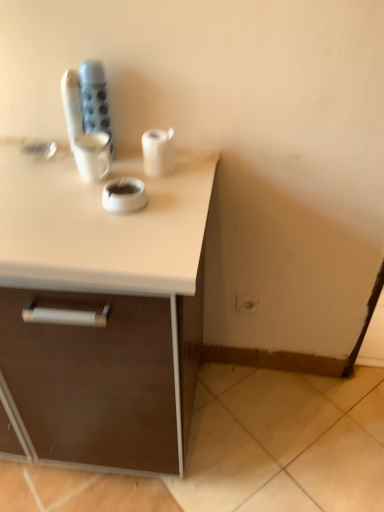
This screenshot has height=512, width=384. In order to click on white matte paper towel at center in this screenshot , I will do `click(158, 152)`.

Does white matte paper towel at center contain white plastic electric outlet at lower right?

No, white plastic electric outlet at lower right is not inside white matte paper towel at center.

From the image's perspective, which is below, white matte paper towel at center or white plastic electric outlet at lower right?

white plastic electric outlet at lower right.

Is white matte paper towel at center bigger than white plastic electric outlet at lower right?

Correct, white matte paper towel at center is larger in size than white plastic electric outlet at lower right.

Does white matte paper towel at center have a greater height compared to white plastic electric outlet at lower right?

Yes.

In the scene shown: Between white matte ashtray at center and white matte paper towel at center, which one has less height?

Standing shorter between the two is white matte ashtray at center.

Is white matte ashtray at center positioned in front of white matte paper towel at center?

Yes, white matte ashtray at center is closer to the camera.

Who is smaller, white matte ashtray at center or white matte paper towel at center?

white matte ashtray at center is smaller.

Is white matte ashtray at center not inside white matte paper towel at center?

white matte ashtray at center is positioned outside white matte paper towel at center.

Which of these two, white matte ashtray at center or white plastic electric outlet at lower right, is thinner?

With smaller width is white plastic electric outlet at lower right.

From a real-world perspective, is white matte ashtray at center physically below white plastic electric outlet at lower right?

Actually, white matte ashtray at center is physically above white plastic electric outlet at lower right in the real world.

Looking at this image, can you confirm if white matte ashtray at center is smaller than white plastic electric outlet at lower right?

Actually, white matte ashtray at center might be larger than white plastic electric outlet at lower right.

Are white plastic electric outlet at lower right and white matte ashtray at center located far from each other?

No, white plastic electric outlet at lower right is not far away from white matte ashtray at center.

Between white plastic electric outlet at lower right and white matte ashtray at center, which one has larger size?

white matte ashtray at center.

Based on the photo, can you confirm if white plastic electric outlet at lower right is wider than white matte ashtray at center?

In fact, white plastic electric outlet at lower right might be narrower than white matte ashtray at center.

Can you confirm if white plastic electric outlet at lower right is bigger than white matte paper towel at center?

Incorrect, white plastic electric outlet at lower right is not larger than white matte paper towel at center.

From the image's perspective, is white plastic electric outlet at lower right on white matte paper towel at center?

No, from the image's perspective, white plastic electric outlet at lower right is not over white matte paper towel at center.

Are white plastic electric outlet at lower right and white matte paper towel at center far apart?

No, white plastic electric outlet at lower right is not far away from white matte paper towel at center.

Is white plastic electric outlet at lower right oriented towards white matte paper towel at center?

No, white plastic electric outlet at lower right does not turn towards white matte paper towel at center.

Is white matte paper towel at center at the left side of white matte ashtray at center?

In fact, white matte paper towel at center is to the right of white matte ashtray at center.

From a real-world perspective, is white matte paper towel at center below white matte ashtray at center?

No.

From their relative heights in the image, would you say white matte paper towel at center is taller or shorter than white matte ashtray at center?

white matte paper towel at center is taller than white matte ashtray at center.

Which is in front, point (154, 152) or point (142, 207)?

Positioned in front is point (142, 207).

Identify the location of paper towel in front of the white plastic electric outlet at lower right. (158, 152).

The image size is (384, 512). Identify the location of coffee lying below the white matte paper towel at center (from the image's perspective). (124, 195).

Considering their positions, is white matte ashtray at center positioned closer to white matte paper towel at center than white plastic electric outlet at lower right?

white matte ashtray at center lies closer to white matte paper towel at center than the other object.

Estimate the real-world distances between objects in this image. Which object is further from white plastic electric outlet at lower right, white matte paper towel at center or white matte ashtray at center?

Among the two, white matte ashtray at center is located further to white plastic electric outlet at lower right.

Estimate the real-world distances between objects in this image. Which object is closer to white matte ashtray at center, white plastic electric outlet at lower right or white matte paper towel at center?

white matte paper towel at center lies closer to white matte ashtray at center than the other object.

In the scene shown: Which object lies further to the anchor point white matte paper towel at center, white plastic electric outlet at lower right or white matte ashtray at center?

The object further to white matte paper towel at center is white plastic electric outlet at lower right.

Based on their spatial positions, is white matte paper towel at center or white plastic electric outlet at lower right closer to white matte ashtray at center?

white matte paper towel at center is positioned closer to the anchor white matte ashtray at center.

Considering their positions, is white matte ashtray at center positioned closer to white plastic electric outlet at lower right than white matte paper towel at center?

white matte paper towel at center lies closer to white plastic electric outlet at lower right than the other object.

I want to click on paper towel between white matte ashtray at center and white plastic electric outlet at lower right in the front-back direction, so click(x=158, y=152).